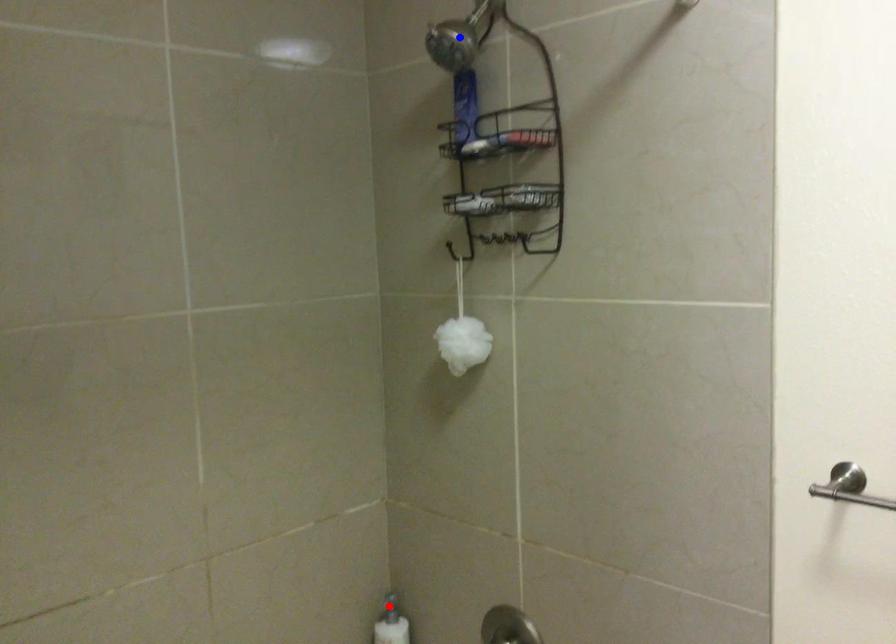
Question: In the image, two points are highlighted. Which point is nearer to the camera? Reply with the corresponding letter.

Choices:
 (A) blue point
 (B) red point

Answer: (A)